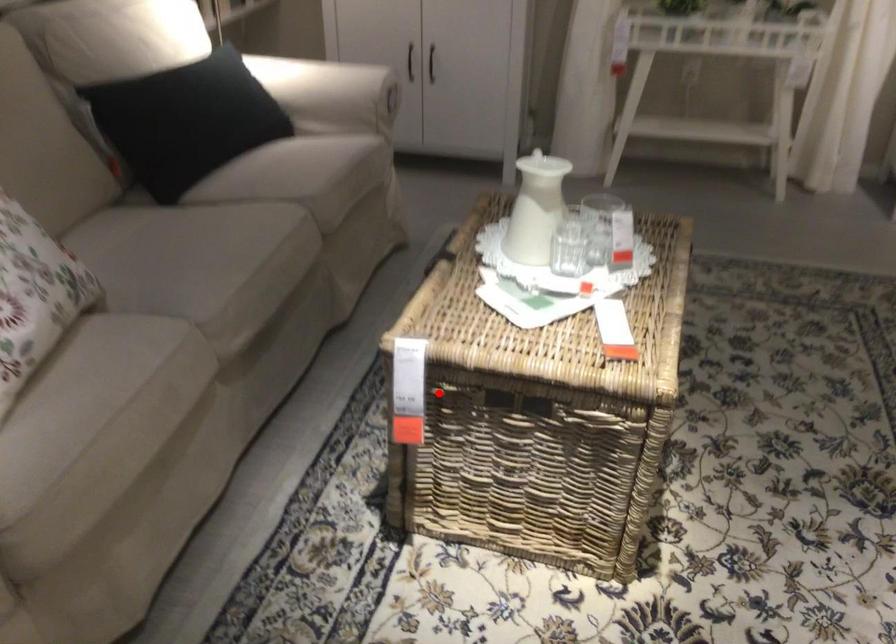
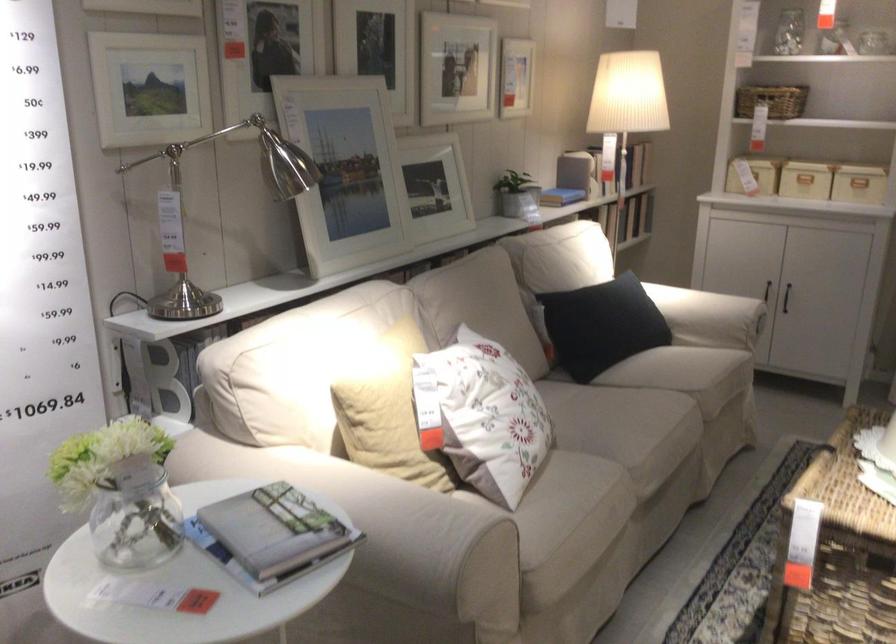
The point at the highlighted location is marked in the first image. Where is the corresponding point in the second image?

(839, 552)